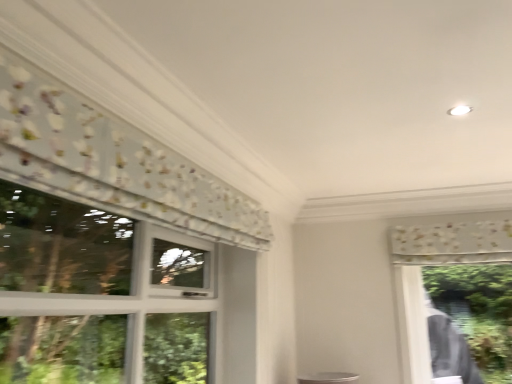
The width and height of the screenshot is (512, 384). What do you see at coordinates (113, 162) in the screenshot?
I see `white floral fabric at upper left` at bounding box center [113, 162].

Where is `white floral fabric at upper left`? white floral fabric at upper left is located at coordinates (113, 162).

What is the approximate width of white floral fabric at upper left?

3.49 inches.

In order to face white floral fabric at upper left, should I rotate leftwards or rightwards?

To face it directly, rotate left by 7.718 degrees.

Locate an element on the screen. white floral fabric at upper left is located at coordinates (113, 162).